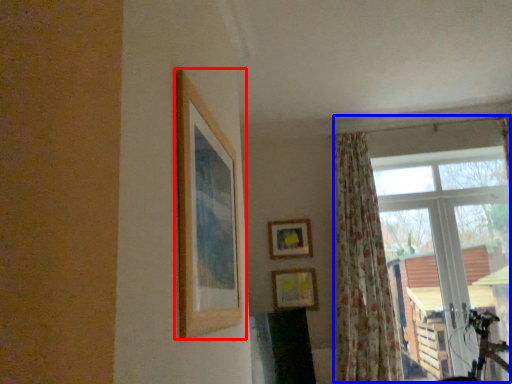
Question: Which object is further to the camera taking this photo, picture frame (highlighted by a red box) or window (highlighted by a blue box)?

Choices:
 (A) picture frame
 (B) window

Answer: (B)